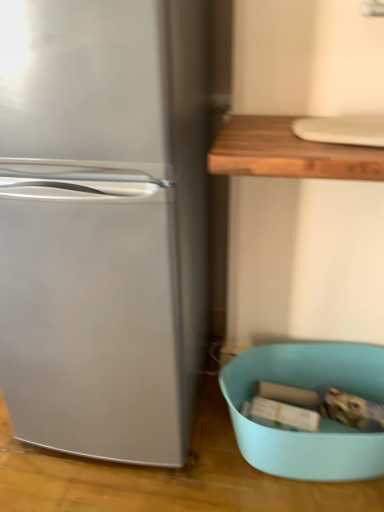
Question: Is teal plastic bowl at lower right spatially inside satin silver refrigerator at left, or outside of it?

Choices:
 (A) inside
 (B) outside

Answer: (B)

Question: Visually, is teal plastic bowl at lower right positioned to the left or to the right of satin silver refrigerator at left?

Choices:
 (A) left
 (B) right

Answer: (B)

Question: Is teal plastic bowl at lower right taller or shorter than satin silver refrigerator at left?

Choices:
 (A) tall
 (B) short

Answer: (B)

Question: Is point (173, 282) positioned closer to the camera than point (367, 354)?

Choices:
 (A) farther
 (B) closer

Answer: (B)

Question: Based on their positions, is satin silver refrigerator at left located to the left or right of teal plastic bowl at lower right?

Choices:
 (A) right
 (B) left

Answer: (B)

Question: Considering the positions of satin silver refrigerator at left and teal plastic bowl at lower right in the image, is satin silver refrigerator at left taller or shorter than teal plastic bowl at lower right?

Choices:
 (A) short
 (B) tall

Answer: (B)

Question: Is satin silver refrigerator at left wider or thinner than teal plastic bowl at lower right?

Choices:
 (A) wide
 (B) thin

Answer: (A)